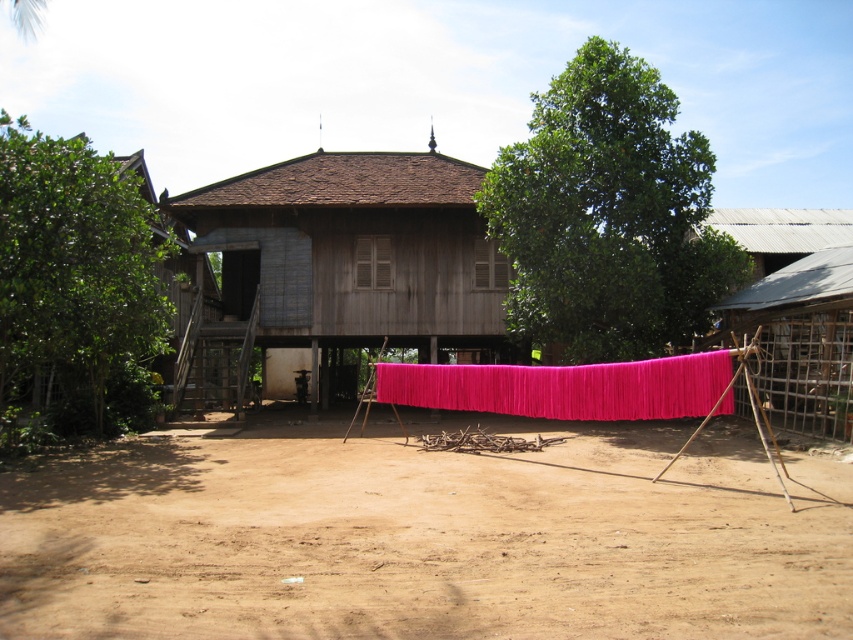
You are standing at the point marked as point (345, 266) in the image. What structure are you facing?

The point (345, 266) indicates wooden hut at center, so you are facing the wooden hut at center.